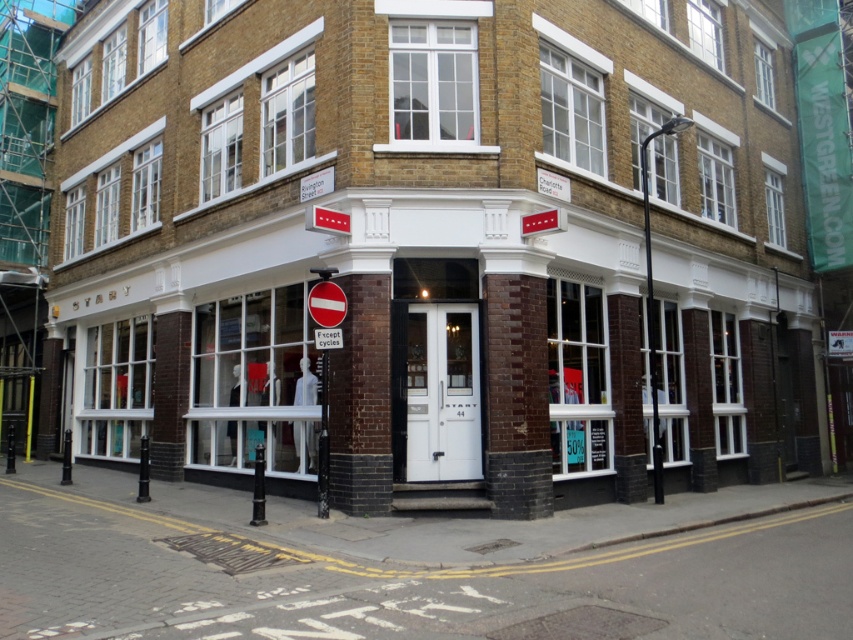
Question: Does black metal pole at upper right appear under metallic pole at center?

Choices:
 (A) yes
 (B) no

Answer: (B)

Question: Which object is closer to the camera taking this photo?

Choices:
 (A) black metal pole at upper right
 (B) metallic pole at center

Answer: (B)

Question: Which point is farther to the camera?

Choices:
 (A) black metal pole at upper right
 (B) metallic pole at center

Answer: (A)

Question: Where is black metal pole at upper right located in relation to metallic pole at center in the image?

Choices:
 (A) above
 (B) below

Answer: (A)

Question: Is black metal pole at upper right smaller than metallic pole at center?

Choices:
 (A) yes
 (B) no

Answer: (A)